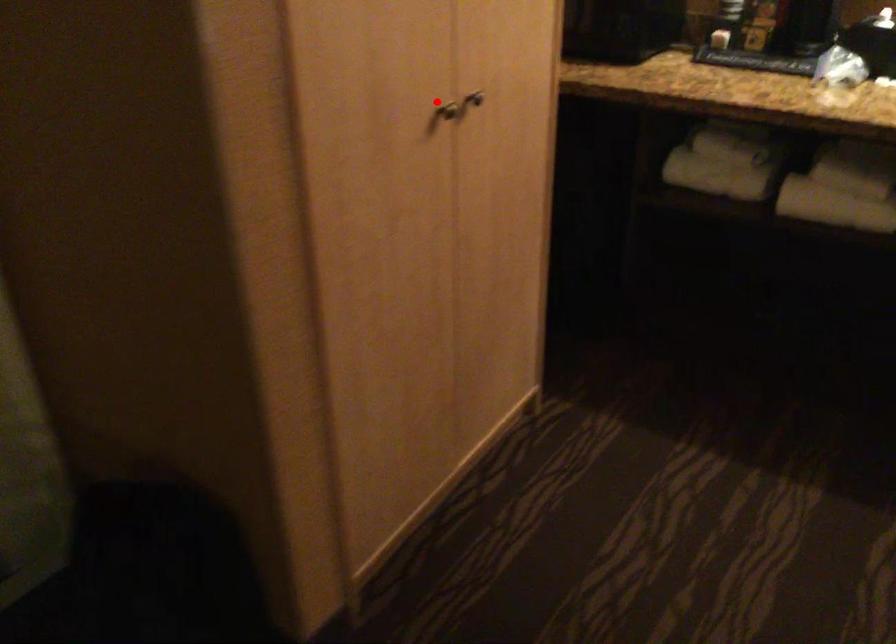
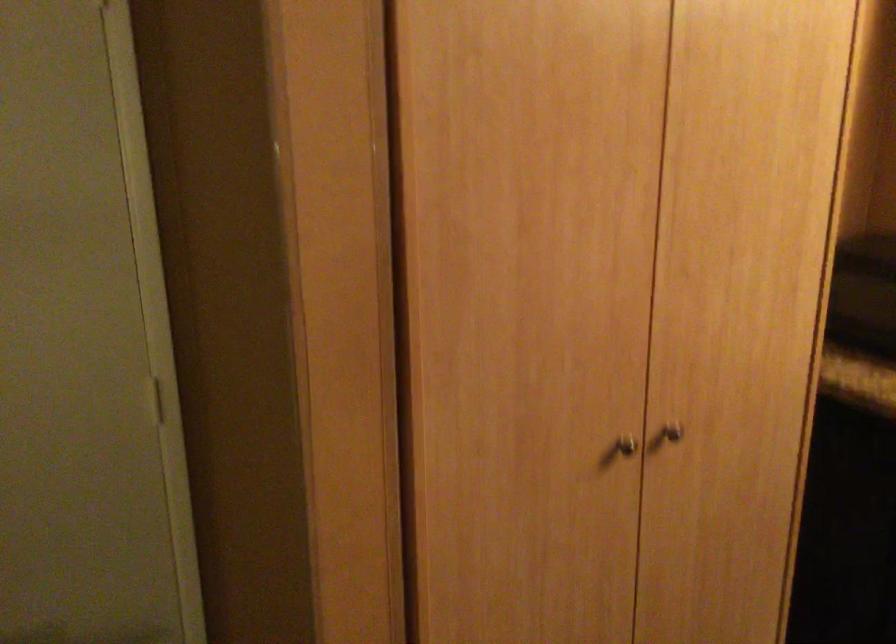
Question: I am providing you with two images of the same scene from different viewpoints. In image1, a red point is highlighted. Considering the same 3D point in image2, which of the following is correct?

Choices:
 (A) It is closer
 (B) It is farther

Answer: (A)